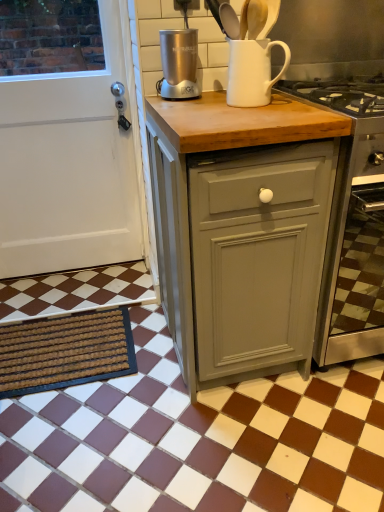
Question: Is the position of satin silver blender at center more distant than that of white matte jug at upper center?

Choices:
 (A) no
 (B) yes

Answer: (B)

Question: Does satin silver blender at center contain white matte jug at upper center?

Choices:
 (A) no
 (B) yes

Answer: (A)

Question: Does satin silver blender at center have a greater width compared to white matte jug at upper center?

Choices:
 (A) no
 (B) yes

Answer: (A)

Question: From a real-world perspective, is satin silver blender at center on white matte jug at upper center?

Choices:
 (A) no
 (B) yes

Answer: (B)

Question: Can you confirm if satin silver blender at center is thinner than white matte jug at upper center?

Choices:
 (A) yes
 (B) no

Answer: (A)

Question: Considering the positions of point tap(132, 218) and point tap(82, 344), is point tap(132, 218) closer or farther from the camera than point tap(82, 344)?

Choices:
 (A) farther
 (B) closer

Answer: (A)

Question: From a real-world perspective, is white matte door at left above or below brown textured mat at lower left?

Choices:
 (A) above
 (B) below

Answer: (A)

Question: Considering their positions, is white matte door at left located in front of or behind brown textured mat at lower left?

Choices:
 (A) behind
 (B) front

Answer: (A)

Question: From the image's perspective, is white matte door at left above or below brown textured mat at lower left?

Choices:
 (A) above
 (B) below

Answer: (A)

Question: In terms of height, does matte gray cabinet at center look taller or shorter compared to brown/white checkered tile at lower center?

Choices:
 (A) short
 (B) tall

Answer: (B)

Question: Based on their positions, is matte gray cabinet at center located to the left or right of brown/white checkered tile at lower center?

Choices:
 (A) left
 (B) right

Answer: (B)

Question: Choose the correct answer: Is matte gray cabinet at center inside brown/white checkered tile at lower center or outside it?

Choices:
 (A) inside
 (B) outside

Answer: (B)

Question: Is matte gray cabinet at center in front of or behind brown/white checkered tile at lower center in the image?

Choices:
 (A) front
 (B) behind

Answer: (B)

Question: Considering the positions of white matte jug at upper center and matte gray cabinet at center in the image, is white matte jug at upper center taller or shorter than matte gray cabinet at center?

Choices:
 (A) tall
 (B) short

Answer: (B)

Question: Looking at their shapes, would you say white matte jug at upper center is wider or thinner than matte gray cabinet at center?

Choices:
 (A) thin
 (B) wide

Answer: (A)